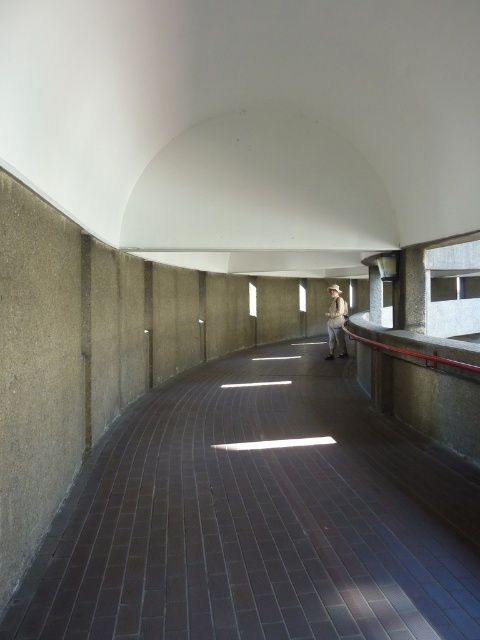
Between dark brick path at center and khaki fabric shirt at center, which one is positioned higher?

Positioned higher is khaki fabric shirt at center.

Does dark brick path at center have a greater width compared to khaki fabric shirt at center?

Correct, the width of dark brick path at center exceeds that of khaki fabric shirt at center.

Where is `dark brick path at center`? This screenshot has width=480, height=640. dark brick path at center is located at coordinates tap(259, 516).